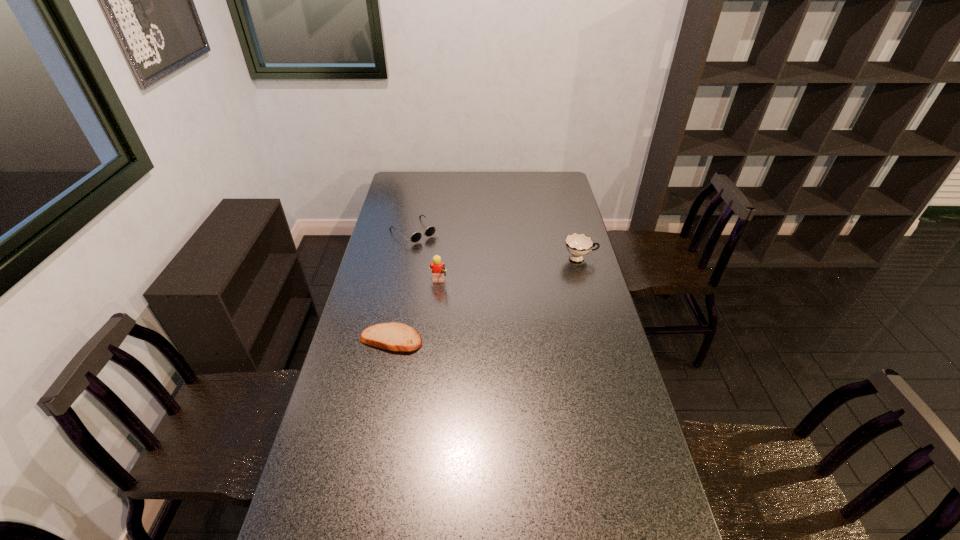
In order to click on vacant space at the right edge of the desktop in this screenshot , I will do `click(549, 218)`.

You are a GUI agent. You are given a task and a screenshot of the screen. Output one action in this format:
    pyautogui.click(x=<x>, y=<y>)
    Task: Click on the free space at the far left corner of the desktop
    This screenshot has height=540, width=960.
    Given the screenshot: What is the action you would take?
    pyautogui.click(x=419, y=178)

What are the coordinates of `free location at the far right corner` in the screenshot? It's located at (539, 174).

You are a GUI agent. You are given a task and a screenshot of the screen. Output one action in this format:
    pyautogui.click(x=<x>, y=<y>)
    Task: Click on the vacant space at the near right corner of the desktop
    The image size is (960, 540).
    Given the screenshot: What is the action you would take?
    pyautogui.click(x=668, y=534)

I want to click on empty space between the second shortest object and the nearest object, so click(402, 286).

Find the location of a particular element. This screenshot has height=540, width=960. free space that is in between the shortest object and the sunglasses is located at coordinates (402, 286).

Image resolution: width=960 pixels, height=540 pixels. Identify the location of free space between the second farthest object and the second shortest object. (497, 245).

Locate an element on the screen. The image size is (960, 540). free space between the pita bread and the Lego is located at coordinates (415, 312).

Identify the location of vacant area between the second nearest object and the second tallest object. This screenshot has width=960, height=540. (509, 272).

In order to click on vacant point located between the sunglasses and the shortest object in this screenshot , I will do `click(402, 286)`.